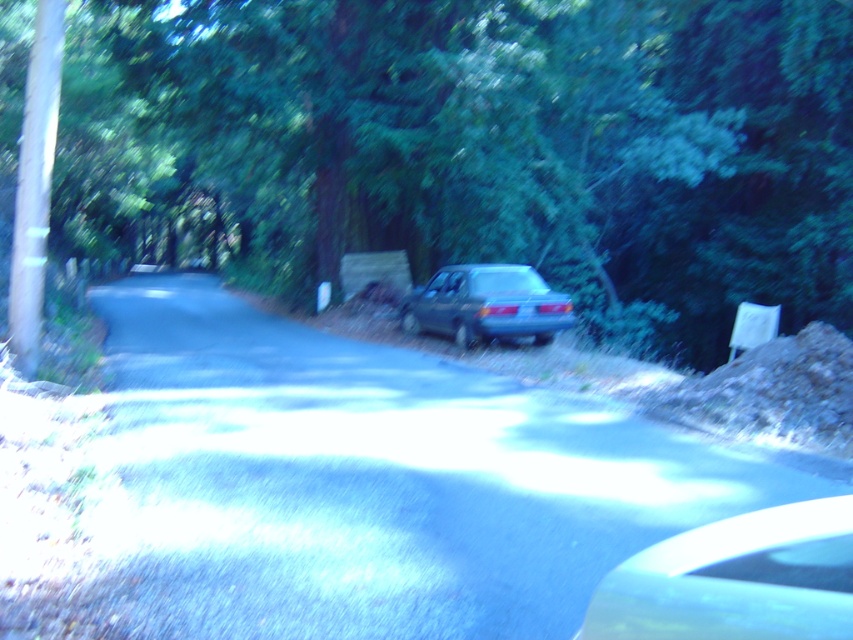
Question: Where is glossy metallic car at center located in relation to satin blue sedan at center in the image?

Choices:
 (A) below
 (B) above

Answer: (A)

Question: Which of the following is the closest to the observer?

Choices:
 (A) (293, 184)
 (B) (691, 628)

Answer: (B)

Question: Which point appears farthest from the camera in this image?

Choices:
 (A) (445, 314)
 (B) (558, 221)

Answer: (B)

Question: Which of the following is the farthest from the observer?

Choices:
 (A) (689, 579)
 (B) (805, 136)

Answer: (B)

Question: Does glossy metallic car at center have a lesser width compared to satin blue sedan at center?

Choices:
 (A) no
 (B) yes

Answer: (B)

Question: Can you confirm if glossy metallic car at center is thinner than satin blue sedan at center?

Choices:
 (A) no
 (B) yes

Answer: (B)